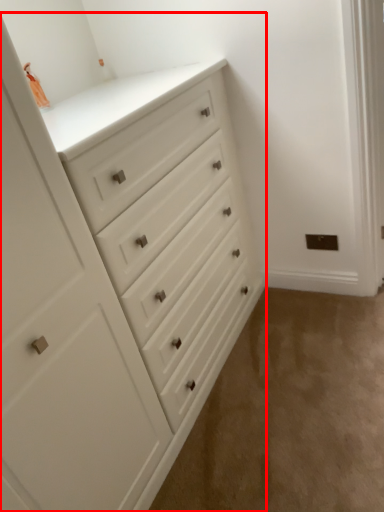
Question: From the image's perspective, where is chest of drawers (annotated by the red box) located in relation to corridor in the image?

Choices:
 (A) below
 (B) above

Answer: (B)